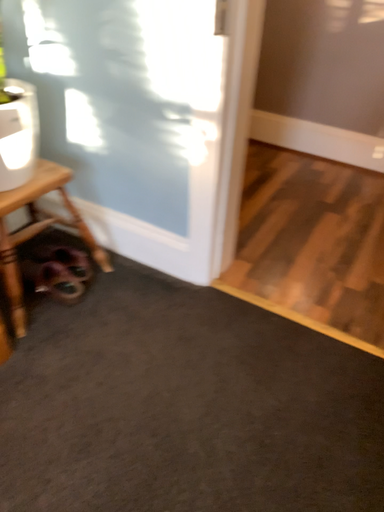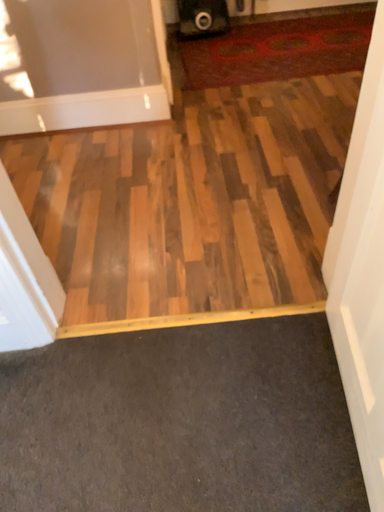
Question: Which way did the camera rotate in the video?

Choices:
 (A) rotated right
 (B) rotated left

Answer: (A)